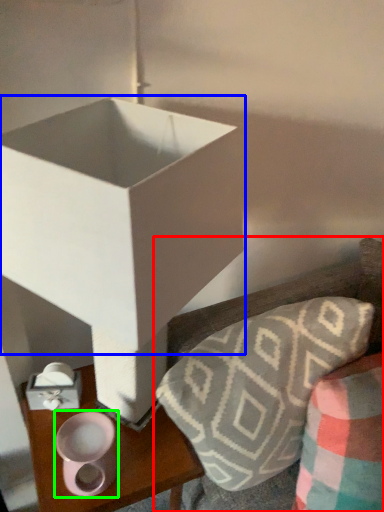
Question: Estimate the real-world distances between objects in this image. Which object is farther from furniture (highlighted by a red box), box (highlighted by a blue box) or candle holder (highlighted by a green box)?

Choices:
 (A) box
 (B) candle holder

Answer: (B)